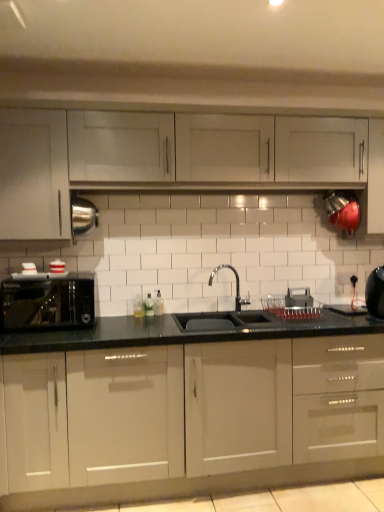
Question: In terms of width, does glossy white cabinets at center, the 3th cabinetry from the top, look wider or thinner when compared to white glossy cabinet at upper left, which appears as the second cabinetry when ordered from the bottom?

Choices:
 (A) thin
 (B) wide

Answer: (B)

Question: Considering the positions of glossy white cabinets at center, the first cabinetry in the bottom-to-top sequence, and white glossy cabinet at upper left, which appears as the second cabinetry when ordered from the bottom, in the image, is glossy white cabinets at center, the first cabinetry in the bottom-to-top sequence, bigger or smaller than white glossy cabinet at upper left, which appears as the second cabinetry when ordered from the bottom,?

Choices:
 (A) big
 (B) small

Answer: (A)

Question: Which of these objects is positioned closest to the satin black toaster at left?

Choices:
 (A) black glossy kettle at right
 (B) white glossy cabinet at upper left, the 2th cabinetry from the top
 (C) translucent plastic bottle at center
 (D) white plastic electric outlet at center
 (E) white glossy cabinets at upper center, the 3th cabinetry in the bottom-to-top sequence

Answer: (B)

Question: Which is nearer to the black glossy kettle at right?

Choices:
 (A) glossy white cabinets at center, the 3th cabinetry from the top
 (B) translucent plastic bottle at center
 (C) white plastic electric outlet at center
 (D) satin black toaster at left
 (E) white glossy cabinets at upper center, placed as the first cabinetry when sorted from top to bottom

Answer: (C)